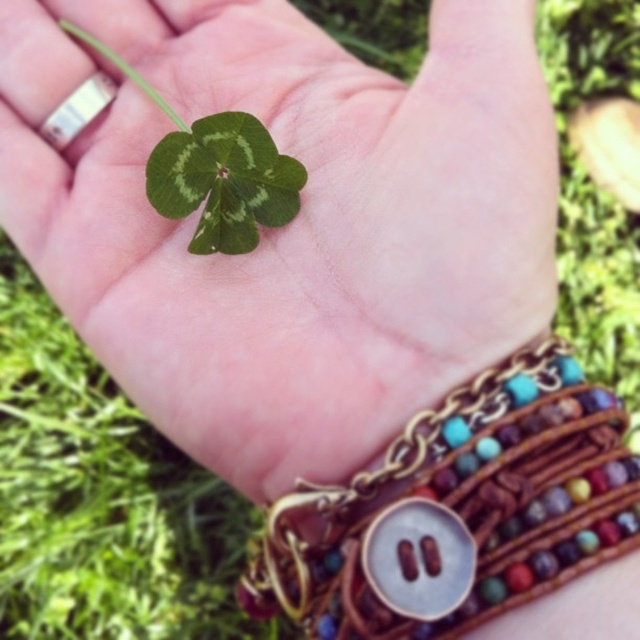
You are a jeweler examining the brown leather bracelet with beads at center and the green matte clover at center in the image. Which object is taller?

The brown leather bracelet with beads at center is taller than the green matte clover at center.

You are a jeweler examining the hand holding a green matte leaf at center and a brown leather bracelet with beads at center. Which object has a greater width?

The green matte leaf at center might be wider than brown leather bracelet with beads at center, so it is possible that the green matte leaf at center has a greater width.

You are a photographer trying to capture the green matte clover at center in focus while ensuring the brown leather bracelet with beads at center is visible but slightly blurred. Based on the scene description, can you achieve this effect without moving the hand?

The brown leather bracelet with beads at center is positioned under the green matte clover at center, so adjusting the camera focus to the green matte clover at center will naturally blur the bracelet below it, achieving the desired effect without moving the hand.